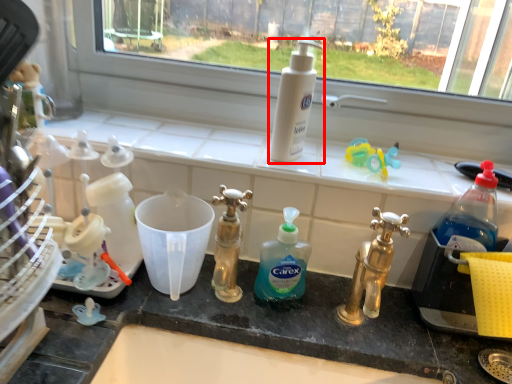
Question: In this image, where is cleaning product (annotated by the red box) located relative to cleaning product?

Choices:
 (A) right
 (B) left

Answer: (A)